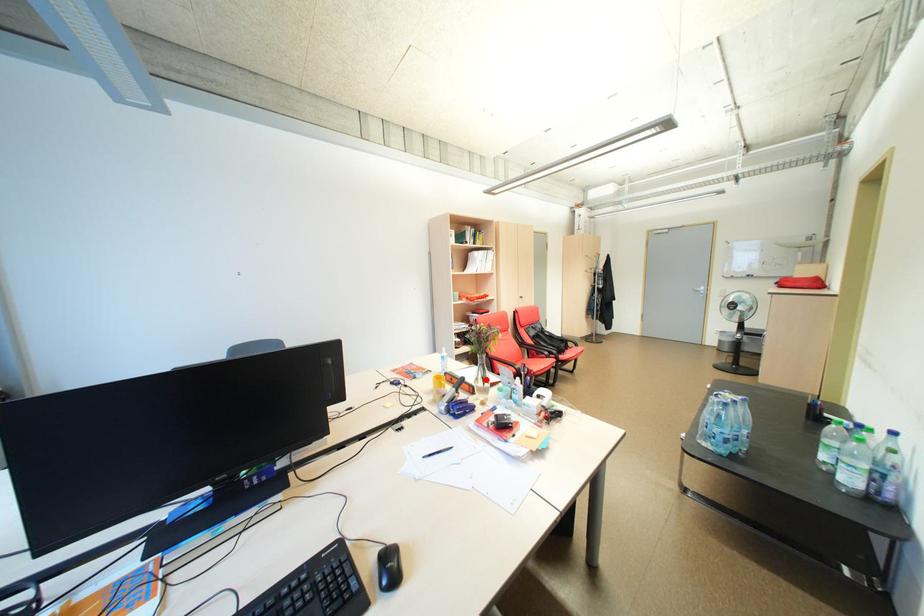
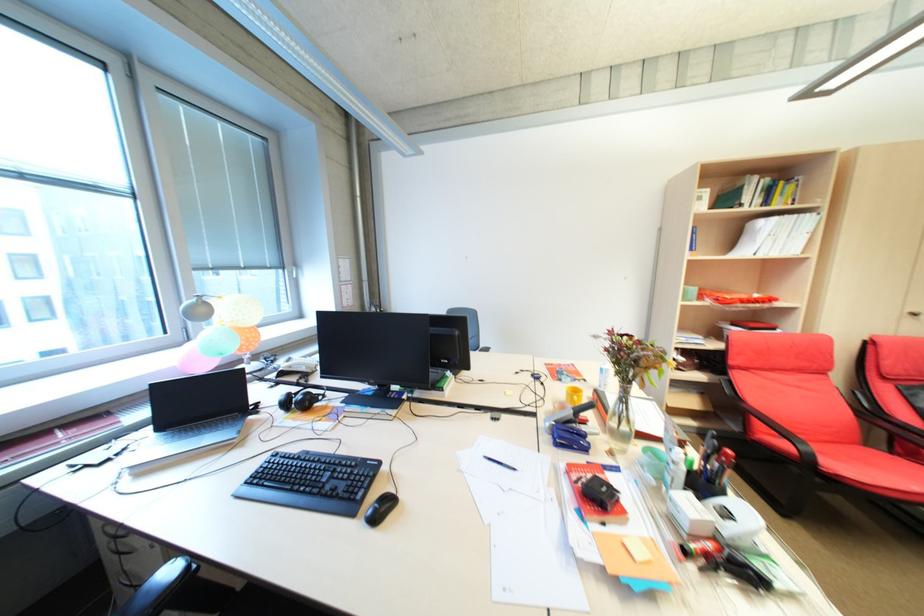
Question: I am providing you with two images of the same scene from different viewpoints. A red point is marked on the first image. Is the red point's position out of view in image 2?

Choices:
 (A) Yes
 (B) No

Answer: (B)